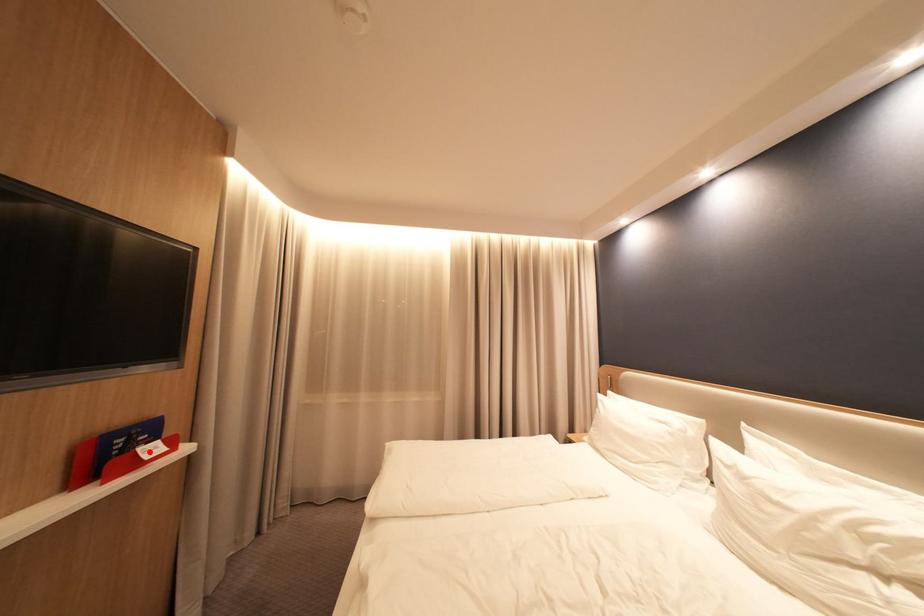
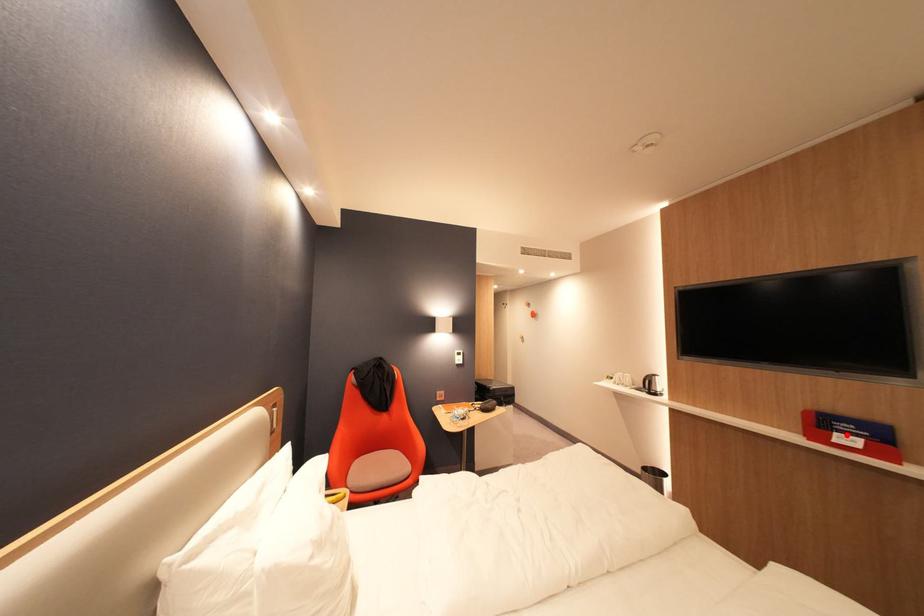
I am providing you with two images of the same scene from different viewpoints. A red point is marked on the first image and another point is marked on the second image. Is the marked point in image1 the same physical position as the marked point in image2?

Yes